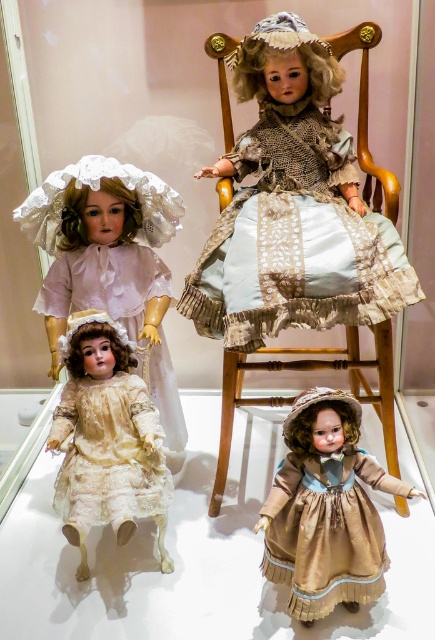
Between point (364, 592) and point (226, 372), which one is positioned behind?

Point (226, 372)

Which is in front, point (367, 572) or point (217, 492)?

Point (367, 572) is in front.

In order to click on satin gold dress at lower right in this screenshot , I will do `click(327, 531)`.

Is transparent glass table at lower center above light blue satin dress at center?

No.

This screenshot has height=640, width=435. Describe the element at coordinates (196, 556) in the screenshot. I see `transparent glass table at lower center` at that location.

Identify the location of transparent glass table at lower center. (196, 556).

Who is more distant from viewer, [214,522] or [104,424]?

The point [214,522] is behind.

Which of these two, transparent glass table at lower center or lace fabric dress at lower left, stands taller?

transparent glass table at lower center

Is point (371, 435) less distant than point (113, 412)?

No.

In order to click on transparent glass table at lower center in this screenshot , I will do `click(196, 556)`.